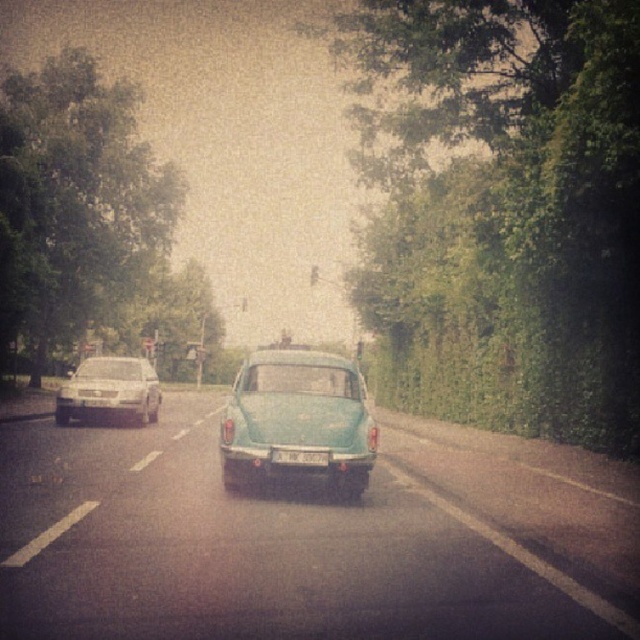
Question: Which object is closer to the camera taking this photo?

Choices:
 (A) green leafy wall at center
 (B) white plastic license plate at center
 (C) teal glossy car at center

Answer: (B)

Question: Which is nearer to the teal glossy car at center?

Choices:
 (A) white plastic license plate at center
 (B) green leafy tree at left
 (C) green leafy wall at center

Answer: (A)

Question: From the image, what is the correct spatial relationship of green leafy wall at center in relation to teal glossy car at center?

Choices:
 (A) below
 (B) above

Answer: (B)

Question: Does green leafy wall at center have a greater width compared to green leafy tree at left?

Choices:
 (A) no
 (B) yes

Answer: (A)

Question: Does green leafy wall at center have a greater width compared to teal glossy car at center?

Choices:
 (A) yes
 (B) no

Answer: (A)

Question: Considering the real-world distances, which object is closest to the silver metallic sedan at left?

Choices:
 (A) teal glossy car at center
 (B) green leafy wall at center
 (C) white plastic license plate at center

Answer: (A)